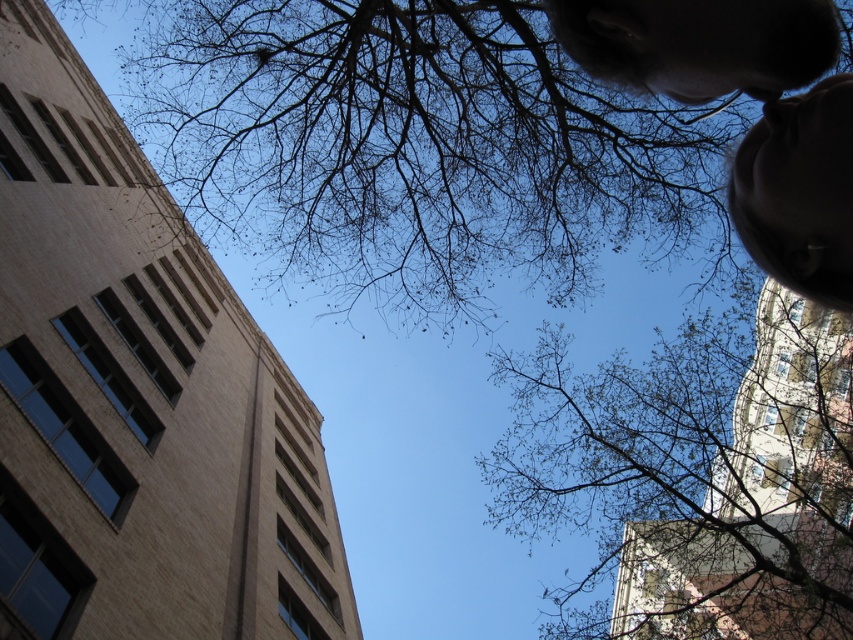
Is beige brick building at left wider than bare branches at upper center?

Incorrect, beige brick building at left's width does not surpass bare branches at upper center's.

Describe the element at coordinates (138, 396) in the screenshot. I see `beige brick building at left` at that location.

The height and width of the screenshot is (640, 853). Identify the location of beige brick building at left. (138, 396).

Can you confirm if brown leafless branches at upper center is positioned to the right of bare branches at upper center?

No, brown leafless branches at upper center is not to the right of bare branches at upper center.

Describe the element at coordinates (419, 148) in the screenshot. The width and height of the screenshot is (853, 640). I see `brown leafless branches at upper center` at that location.

Identify the location of brown leafless branches at upper center. This screenshot has width=853, height=640. (419, 148).

Which of these two, beige brick building at left or brown leafless branches at upper center, stands shorter?

With less height is brown leafless branches at upper center.

Which is behind, point (328, 561) or point (357, 252)?

The point (328, 561) is more distant.

Locate an element on the screen. beige brick building at left is located at coordinates (138, 396).

Where is `beige brick building at left`? This screenshot has height=640, width=853. beige brick building at left is located at coordinates (138, 396).